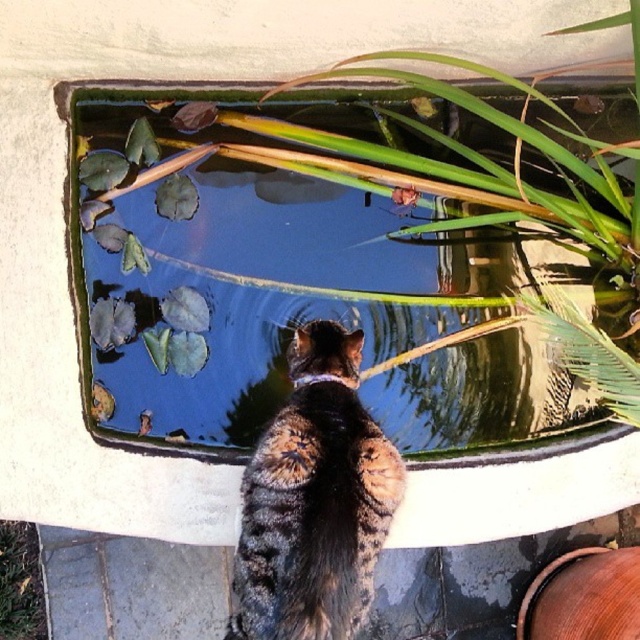
You are a gardener looking at the image. You need to water both the green leafy plant at upper center and the green leafy plant at lower left. Which plant requires more water based on their sizes?

The green leafy plant at upper center requires more water because it is bigger than the green leafy plant at lower left.

You are standing at the point marked as point (173, 225) in the image, which is 8.17 feet away from you. You want to throw a small pebble into the water feature to see the ripples. Will you be able to reach the water feature from your current position without moving closer?

The point marked as point (173, 225) is 8.17 feet away from you. Since you are already at that point, you are already at the edge of the water feature where the cat is positioned. Therefore, you can easily throw the pebble into the water feature without needing to move closer.